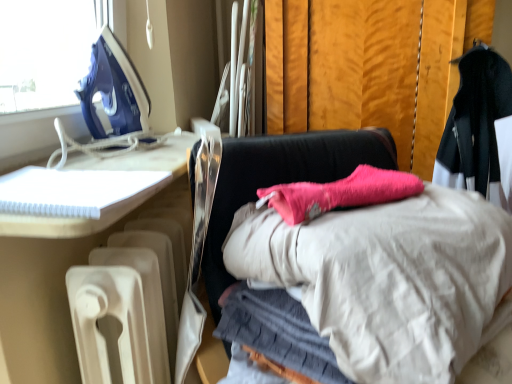
Where is `blue plastic iron at upper left`? blue plastic iron at upper left is located at coordinates (110, 104).

Describe the element at coordinates (110, 104) in the screenshot. I see `blue plastic iron at upper left` at that location.

The width and height of the screenshot is (512, 384). What do you see at coordinates (42, 293) in the screenshot?
I see `white plastic radiator at lower left, the 2th furniture from the left` at bounding box center [42, 293].

Locate an element on the screen. pink fabric at center, which is the 3th furniture from left to right is located at coordinates (281, 179).

You are a GUI agent. You are given a task and a screenshot of the screen. Output one action in this format:
    pyautogui.click(x=<x>, y=<y>)
    Task: Click on the blue plastic iron at upper left
    The height and width of the screenshot is (384, 512).
    Given the screenshot: What is the action you would take?
    pyautogui.click(x=110, y=104)

Is white plastic radiator at lower left, which ranks as the second furniture in right-to-left order, inside blue plastic iron at upper left?

No, white plastic radiator at lower left, which ranks as the second furniture in right-to-left order, is located outside of blue plastic iron at upper left.

Is blue plastic iron at upper left wider than white plastic radiator at lower left, the 2th furniture from the left?

Indeed, blue plastic iron at upper left has a greater width compared to white plastic radiator at lower left, the 2th furniture from the left.

Does blue plastic iron at upper left touch white plastic radiator at lower left, the 2th furniture from the left?

No, blue plastic iron at upper left is not making contact with white plastic radiator at lower left, the 2th furniture from the left.

Does blue plastic iron at upper left come in front of white plastic radiator at lower left, the 2th furniture from the left?

That is False.

Can you confirm if white plastic radiator at lower left, the 2th furniture from the left, is bigger than black woolen coat at upper right?

Yes.

From a real-world perspective, is white plastic radiator at lower left, which ranks as the second furniture in right-to-left order, positioned above or below black woolen coat at upper right?

Clearly, from a real-world perspective, white plastic radiator at lower left, which ranks as the second furniture in right-to-left order, is below black woolen coat at upper right.

Which object is positioned more to the right, white plastic radiator at lower left, the 2th furniture from the left, or black woolen coat at upper right?

Positioned to the right is black woolen coat at upper right.

From the image's perspective, is white plastic radiator at lower left, which ranks as the second furniture in right-to-left order, above or below black woolen coat at upper right?

Clearly, from the image's perspective, white plastic radiator at lower left, which ranks as the second furniture in right-to-left order, is below black woolen coat at upper right.

Can you confirm if white plastic radiator at lower left, the 2th furniture from the left, is thinner than pink fabric at center, the first furniture positioned from the right?

Yes, white plastic radiator at lower left, the 2th furniture from the left, is thinner than pink fabric at center, the first furniture positioned from the right.

Would you say white plastic radiator at lower left, which ranks as the second furniture in right-to-left order, is inside or outside pink fabric at center, the first furniture positioned from the right?

white plastic radiator at lower left, which ranks as the second furniture in right-to-left order, is not inside pink fabric at center, the first furniture positioned from the right, it's outside.

Is white plastic radiator at lower left, which ranks as the second furniture in right-to-left order, next to pink fabric at center, which is the 3th furniture from left to right?

They are not placed beside each other.

From a real-world perspective, does white plastic radiator at lower left, the 2th furniture from the left, stand above pink fabric at center, which is the 3th furniture from left to right?

Actually, white plastic radiator at lower left, the 2th furniture from the left, is physically below pink fabric at center, which is the 3th furniture from left to right, in the real world.

Which of these two, pink fabric at center, the first furniture positioned from the right, or white plastic radiator at lower left, the 2th furniture from the left, stands shorter?

pink fabric at center, the first furniture positioned from the right.

Is pink fabric at center, which is the 3th furniture from left to right, in front of or behind white plastic radiator at lower left, which ranks as the second furniture in right-to-left order, in the image?

Clearly, pink fabric at center, which is the 3th furniture from left to right, is in front of white plastic radiator at lower left, which ranks as the second furniture in right-to-left order.

From the image's perspective, is pink fabric at center, the first furniture positioned from the right, positioned above or below white plastic radiator at lower left, which ranks as the second furniture in right-to-left order?

Based on their image positions, pink fabric at center, the first furniture positioned from the right, is located above white plastic radiator at lower left, which ranks as the second furniture in right-to-left order.

Is white plastic radiator at lower left, which ranks as the second furniture in right-to-left order, oriented away from white plastic notebook at left, which ranks as the 3th furniture in right-to-left order?

No.

Based on the photo, from a real-world perspective, is white plastic radiator at lower left, which ranks as the second furniture in right-to-left order, beneath white plastic notebook at left, which ranks as the 3th furniture in right-to-left order?

Yes, from a real-world perspective, white plastic radiator at lower left, which ranks as the second furniture in right-to-left order, is below white plastic notebook at left, which ranks as the 3th furniture in right-to-left order.

Is white plastic notebook at left, which ranks as the 3th furniture in right-to-left order, inside white plastic radiator at lower left, which ranks as the second furniture in right-to-left order?

Definitely not — white plastic notebook at left, which ranks as the 3th furniture in right-to-left order, is not inside white plastic radiator at lower left, which ranks as the second furniture in right-to-left order.

Considering the relative sizes of black woolen coat at upper right and pink fabric at center, the first furniture positioned from the right, in the image provided, is black woolen coat at upper right taller than pink fabric at center, the first furniture positioned from the right,?

Correct, black woolen coat at upper right is much taller as pink fabric at center, the first furniture positioned from the right.

Could pink fabric at center, the first furniture positioned from the right, be considered to be inside black woolen coat at upper right?

Definitely not — pink fabric at center, the first furniture positioned from the right, is not inside black woolen coat at upper right.

Does black woolen coat at upper right lie in front of pink fabric at center, which is the 3th furniture from left to right?

No, black woolen coat at upper right is further to the viewer.

Considering the sizes of objects black woolen coat at upper right and pink fabric at center, the first furniture positioned from the right, in the image provided, who is wider, black woolen coat at upper right or pink fabric at center, the first furniture positioned from the right,?

Wider between the two is pink fabric at center, the first furniture positioned from the right.

How different are the orientations of pink fabric at center, which is the 3th furniture from left to right, and blue plastic iron at upper left in degrees?

45.8 degrees.

Which is in front, pink fabric at center, the first furniture positioned from the right, or blue plastic iron at upper left?

pink fabric at center, the first furniture positioned from the right, is in front.

From the image's perspective, between pink fabric at center, which is the 3th furniture from left to right, and blue plastic iron at upper left, which one is located above?

blue plastic iron at upper left.

This screenshot has width=512, height=384. I want to click on sewing machine that is behind the white plastic radiator at lower left, the 2th furniture from the left, so click(110, 104).

Identify the location of clothing positioned vertically above the white plastic radiator at lower left, the 2th furniture from the left (from a real-world perspective). The width and height of the screenshot is (512, 384). (479, 129).

Based on their spatial positions, is pink fabric at center, the first furniture positioned from the right, or black woolen coat at upper right closer to blue plastic iron at upper left?

pink fabric at center, the first furniture positioned from the right, lies closer to blue plastic iron at upper left than the other object.

When comparing their distances from white plastic notebook at left, which ranks as the 3th furniture in right-to-left order, does blue plastic iron at upper left or pink fabric at center, the first furniture positioned from the right, seem closer?

blue plastic iron at upper left lies closer to white plastic notebook at left, which ranks as the 3th furniture in right-to-left order, than the other object.

Based on their spatial positions, is white plastic notebook at left, which ranks as the 3th furniture in right-to-left order, or white plastic radiator at lower left, the 2th furniture from the left, closer to blue plastic iron at upper left?

white plastic notebook at left, which ranks as the 3th furniture in right-to-left order, lies closer to blue plastic iron at upper left than the other object.

Which object lies further to the anchor point white plastic radiator at lower left, which ranks as the second furniture in right-to-left order, white plastic notebook at left, which ranks as the 3th furniture in right-to-left order, or pink fabric at center, which is the 3th furniture from left to right?

pink fabric at center, which is the 3th furniture from left to right, is positioned further to the anchor white plastic radiator at lower left, which ranks as the second furniture in right-to-left order.

Looking at the image, which one is located closer to blue plastic iron at upper left, black woolen coat at upper right or white plastic notebook at left, which ranks as the 3th furniture in right-to-left order?

white plastic notebook at left, which ranks as the 3th furniture in right-to-left order, is closer to blue plastic iron at upper left.

Estimate the real-world distances between objects in this image. Which object is closer to white plastic radiator at lower left, the 2th furniture from the left, black woolen coat at upper right or white plastic notebook at left, which ranks as the 3th furniture in right-to-left order?

Among the two, white plastic notebook at left, which ranks as the 3th furniture in right-to-left order, is located nearer to white plastic radiator at lower left, the 2th furniture from the left.

Looking at the image, which one is located further to pink fabric at center, the first furniture positioned from the right, white plastic radiator at lower left, which ranks as the second furniture in right-to-left order, or white plastic notebook at left, which is counted as the 1th furniture, starting from the left?

Among the two, white plastic radiator at lower left, which ranks as the second furniture in right-to-left order, is located further to pink fabric at center, the first furniture positioned from the right.

Estimate the real-world distances between objects in this image. Which object is further from white plastic radiator at lower left, the 2th furniture from the left, black woolen coat at upper right or blue plastic iron at upper left?

Among the two, black woolen coat at upper right is located further to white plastic radiator at lower left, the 2th furniture from the left.

You are a GUI agent. You are given a task and a screenshot of the screen. Output one action in this format:
    pyautogui.click(x=<x>, y=<y>)
    Task: Click on the furniture between white plastic notebook at left, which ranks as the 3th furniture in right-to-left order, and pink fabric at center, which is the 3th furniture from left to right, in the horizontal direction
    
    Given the screenshot: What is the action you would take?
    pyautogui.click(x=42, y=293)

At what (x,y) coordinates should I click in order to perform the action: click on furniture situated between white plastic radiator at lower left, the 2th furniture from the left, and black woolen coat at upper right from left to right. Please return your answer as a coordinate pair (x, y). Looking at the image, I should click on (281, 179).